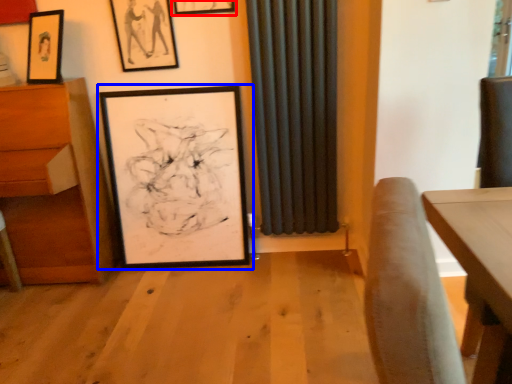
Question: Among these objects, which one is farthest to the camera, picture frame (highlighted by a red box) or picture frame (highlighted by a blue box)?

Choices:
 (A) picture frame
 (B) picture frame

Answer: (B)